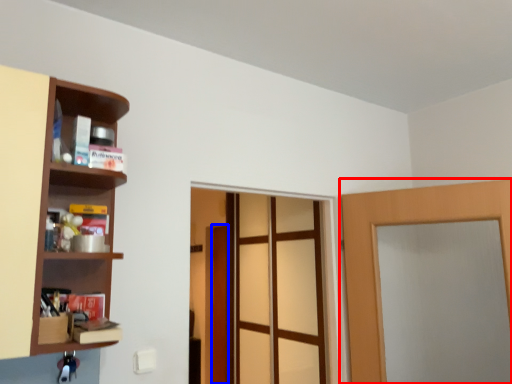
Question: Among these objects, which one is nearest to the camera, door (highlighted by a red box) or door (highlighted by a blue box)?

Choices:
 (A) door
 (B) door

Answer: (A)